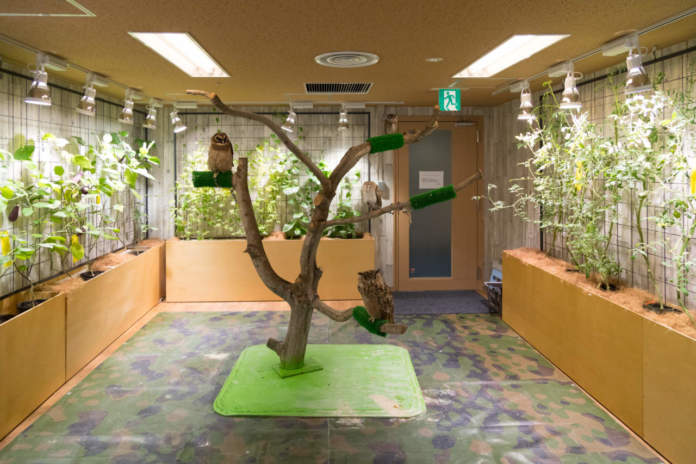
Find the location of a particular element. vent is located at coordinates (337, 60), (342, 93).